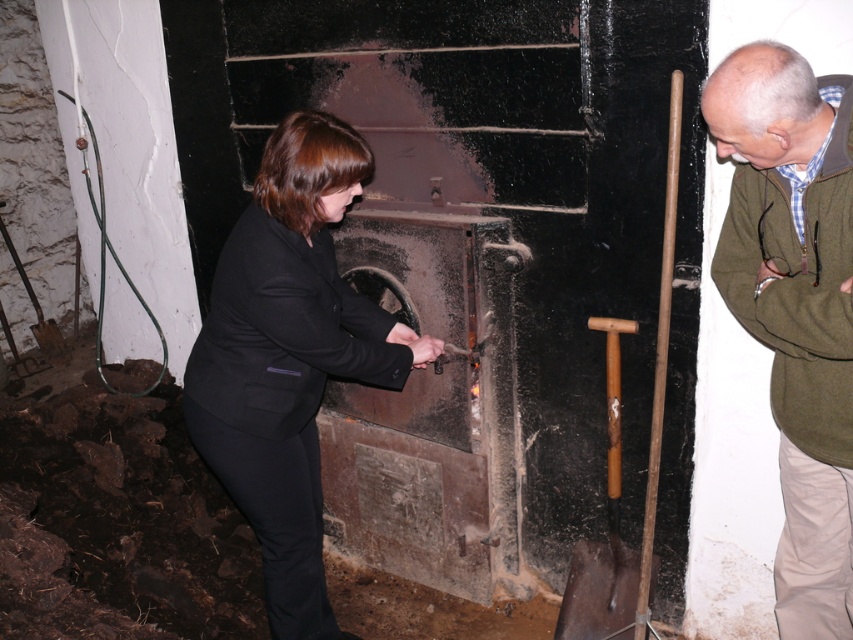
Who is more forward, (791,136) or (674,154)?

Point (791,136) is in front.

Where is `green wool sweater at right`? This screenshot has height=640, width=853. green wool sweater at right is located at coordinates (795, 305).

Is wooden shovel at right closer to the viewer compared to rusty metal shovel at lower right?

Yes, wooden shovel at right is in front of rusty metal shovel at lower right.

In the scene shown: Who is shorter, wooden shovel at right or rusty metal shovel at lower right?

rusty metal shovel at lower right is shorter.

Image resolution: width=853 pixels, height=640 pixels. What do you see at coordinates (619, 465) in the screenshot?
I see `wooden shovel at right` at bounding box center [619, 465].

Identify the location of wooden shovel at right. The width and height of the screenshot is (853, 640). (619, 465).

Is black matte suit at center above green wool sweater at right?

Incorrect, black matte suit at center is not positioned above green wool sweater at right.

Does black matte suit at center appear on the left side of green wool sweater at right?

Correct, you'll find black matte suit at center to the left of green wool sweater at right.

Is point (277, 493) positioned in front of point (709, 93)?

No, it is behind (709, 93).

At what (x,y) coordinates should I click in order to perform the action: click on black matte suit at center. Please return your answer as a coordinate pair (x, y). The width and height of the screenshot is (853, 640). Looking at the image, I should click on (289, 356).